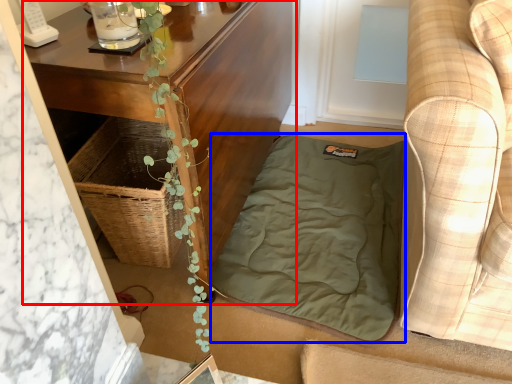
Question: Which of the following is the closest to the observer, table (highlighted by a red box) or blanket (highlighted by a blue box)?

Choices:
 (A) table
 (B) blanket

Answer: (A)